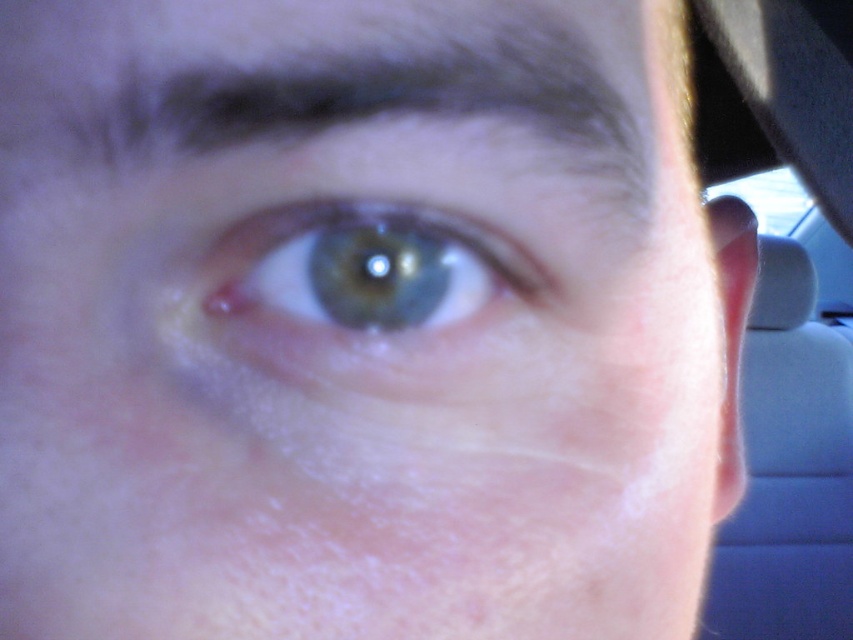
You are a photographer trying to capture a closeup of the dark brown hair at upper center and the green matte eye at center. Based on the image, which object would require a wider lens opening to ensure proper focus?

The dark brown hair at upper center requires a wider lens opening because it has a larger size compared to the green matte eye at center, which would need more light to capture details clearly.